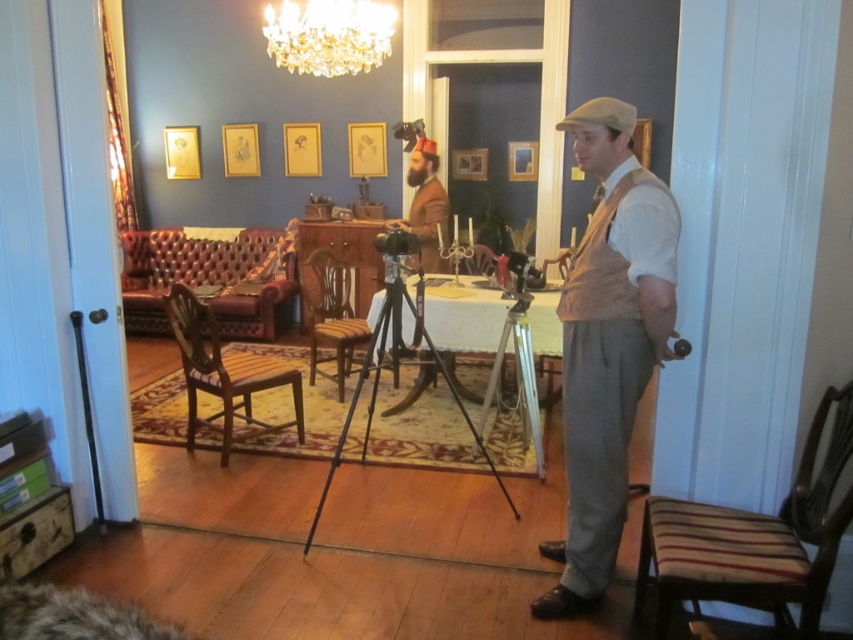
Consider the image. You are a photographer setting up a shoot in this vintage living room. You need to place a new lamp that is 1.2 meters tall between the striped fabric stool at lower right and the crystal glass chandelier at upper center. Can the lamp fit vertically between them without touching either?

The striped fabric stool at lower right is not as tall as the crystal glass chandelier at upper center. Since the lamp is 1.2 meters tall, it depends on the vertical distance between them. However, since the stool is shorter than the chandelier, there is enough vertical space for the lamp to fit between them as long as the total height from the stool to the chandelier exceeds 1.2 meters. Without exact measurements, we can infer that the vertical space likely accommodates the lamp since the chandelier is at

You are an interior designer assessing the vintage living room. You notice the light brown fabric vest at center and the crystal glass chandelier at upper center. Which object is positioned to the right when viewed from your perspective?

The light brown fabric vest at center is to the right of the crystal glass chandelier at upper center.

You are a tailor measuring the light brown fabric vest at center and the crystal glass chandelier at upper center for a historical costume. Which item has a smaller width?

The light brown fabric vest at center has a smaller width than the crystal glass chandelier at upper center.